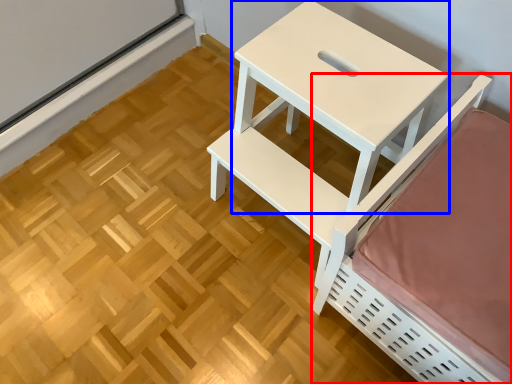
Question: Which point is closer to the camera, furniture (highlighted by a red box) or table (highlighted by a blue box)?

Choices:
 (A) furniture
 (B) table

Answer: (A)